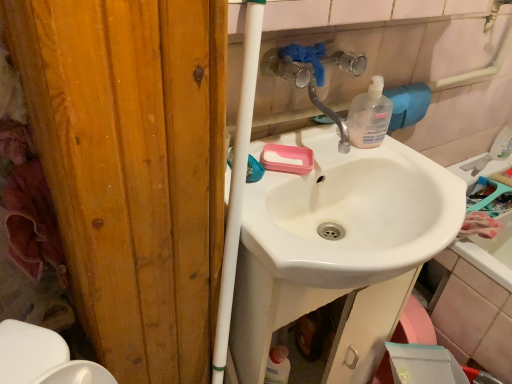
Question: Could white glossy sink at center be considered to be inside translucent plastic soap dispenser at upper right?

Choices:
 (A) yes
 (B) no

Answer: (B)

Question: Can you confirm if translucent plastic soap dispenser at upper right is bigger than white glossy sink at center?

Choices:
 (A) no
 (B) yes

Answer: (A)

Question: From the image's perspective, is translucent plastic soap dispenser at upper right located above white glossy sink at center?

Choices:
 (A) no
 (B) yes

Answer: (B)

Question: From a real-world perspective, does translucent plastic soap dispenser at upper right stand above white glossy sink at center?

Choices:
 (A) no
 (B) yes

Answer: (B)

Question: Is translucent plastic soap dispenser at upper right wider than white glossy sink at center?

Choices:
 (A) no
 (B) yes

Answer: (A)

Question: Does translucent plastic soap dispenser at upper right appear on the right side of white glossy sink at center?

Choices:
 (A) no
 (B) yes

Answer: (A)

Question: Is white glossy sink at center positioned in front of translucent plastic soap dispenser at upper right?

Choices:
 (A) no
 (B) yes

Answer: (A)

Question: Is white glossy sink at center further to the viewer compared to translucent plastic soap dispenser at upper right?

Choices:
 (A) no
 (B) yes

Answer: (B)

Question: Considering the relative positions of white glossy sink at center and translucent plastic soap dispenser at upper right in the image provided, is white glossy sink at center to the left of translucent plastic soap dispenser at upper right from the viewer's perspective?

Choices:
 (A) yes
 (B) no

Answer: (B)

Question: Would you say translucent plastic soap dispenser at upper right is part of white glossy sink at center's contents?

Choices:
 (A) no
 (B) yes

Answer: (A)

Question: From the image's perspective, is white glossy sink at center on top of translucent plastic soap dispenser at upper right?

Choices:
 (A) yes
 (B) no

Answer: (B)

Question: Is white glossy sink at center at the right side of translucent plastic soap dispenser at upper right?

Choices:
 (A) yes
 (B) no

Answer: (A)

Question: Does translucent plastic soap dispenser at upper right lie behind clear plastic faucet at upper center?

Choices:
 (A) yes
 (B) no

Answer: (A)